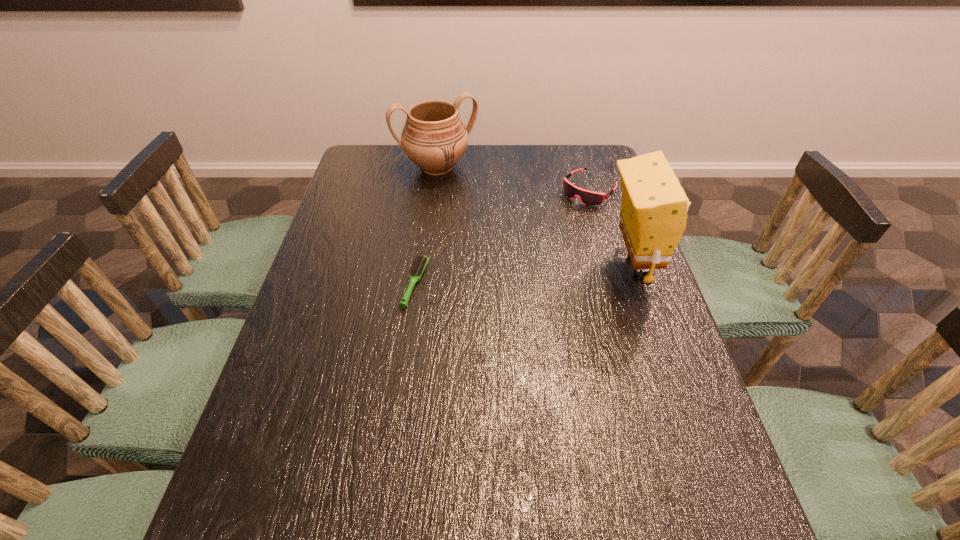
Locate an element on the screen. The image size is (960, 540). vacant area located on the front-facing side of the goggles is located at coordinates (516, 261).

At what (x,y) coordinates should I click in order to perform the action: click on urn at the far edge. Please return your answer as a coordinate pair (x, y). Looking at the image, I should click on (434, 137).

Where is `goggles that is at the far edge`? The height and width of the screenshot is (540, 960). goggles that is at the far edge is located at coordinates (589, 198).

Identify the location of object that is at the left edge. (434, 137).

Locate an element on the screen. Image resolution: width=960 pixels, height=540 pixels. sponge that is positioned at the right edge is located at coordinates pos(654,207).

In order to click on goggles that is positioned at the right edge in this screenshot , I will do `click(589, 198)`.

Where is `object that is at the far left corner`? Image resolution: width=960 pixels, height=540 pixels. object that is at the far left corner is located at coordinates (434, 137).

Identify the location of object that is positioned at the far right corner. (589, 198).

Image resolution: width=960 pixels, height=540 pixels. What are the coordinates of `vacant space at the far edge of the desktop` in the screenshot? It's located at (488, 165).

In the image, there is a desktop. Where is `vacant space at the near edge`? The image size is (960, 540). vacant space at the near edge is located at coordinates (614, 476).